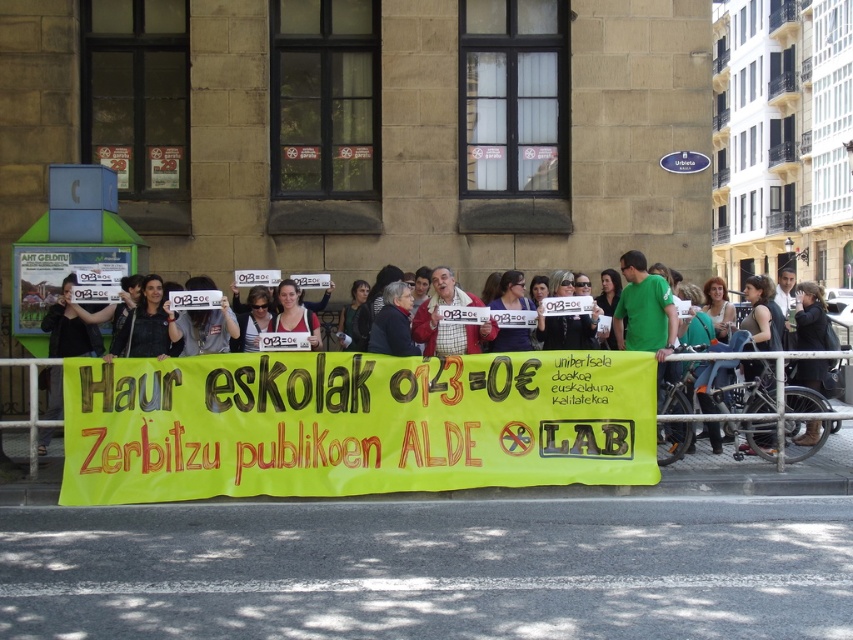
Between dark gray jacket at center and matte black shirt at center, which one has more height?

With more height is dark gray jacket at center.

Who is positioned more to the left, dark gray jacket at center or matte black shirt at center?

Positioned to the left is dark gray jacket at center.

Who is more forward, [97,307] or [146,282]?

Point [146,282]

Find the location of a particular element. dark gray jacket at center is located at coordinates (68, 326).

Between yellow fabric banner at center and white paper sign at center, which one appears on the left side from the viewer's perspective?

white paper sign at center

Can you confirm if yellow fabric banner at center is positioned below white paper sign at center?

No, yellow fabric banner at center is not below white paper sign at center.

The width and height of the screenshot is (853, 640). Find the location of `yellow fabric banner at center`. yellow fabric banner at center is located at coordinates (447, 324).

Does matte white sign at center appear on the left side of matte white shirt at center?

In fact, matte white sign at center is to the right of matte white shirt at center.

In the scene shown: Is matte white sign at center smaller than matte white shirt at center?

No, matte white sign at center is not smaller than matte white shirt at center.

Describe the element at coordinates (733, 387) in the screenshot. This screenshot has height=640, width=853. I see `matte white sign at center` at that location.

Locate an element on the screen. This screenshot has height=640, width=853. matte white sign at center is located at coordinates (733, 387).